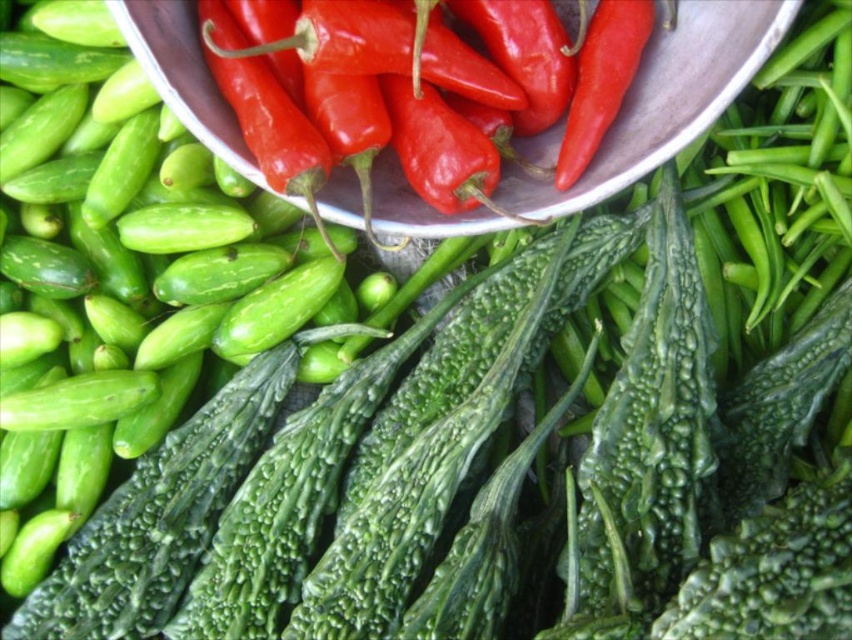
You are a vendor arranging vegetables in the market. You have a green matte cucumber at left and a metallic bowl at upper center. If you want to place the cucumber closer to the bowl, how much distance do you need to reduce between them?

The current distance between the green matte cucumber at left and the metallic bowl at upper center is 10.98 inches. To place the cucumber closer, you need to reduce the distance by moving it towards the bowl until the desired proximity is achieved.

You are a customer at the market and want to place a green matte cucumber at left into the metallic bowl at upper center. Can you move it directly to the bowl without moving any other vegetables?

The green matte cucumber at left is to the left of the metallic bowl at upper center, so you can move it directly to the bowl without needing to move other vegetables.

You are standing in front of the vegetable display and want to pick up both items located at point [273,224] and point [600,198]. Which point do you need to reach first to grab the closer item?

You should reach for point [273,224] first because it is closer to you than point [600,198], as it is further away.